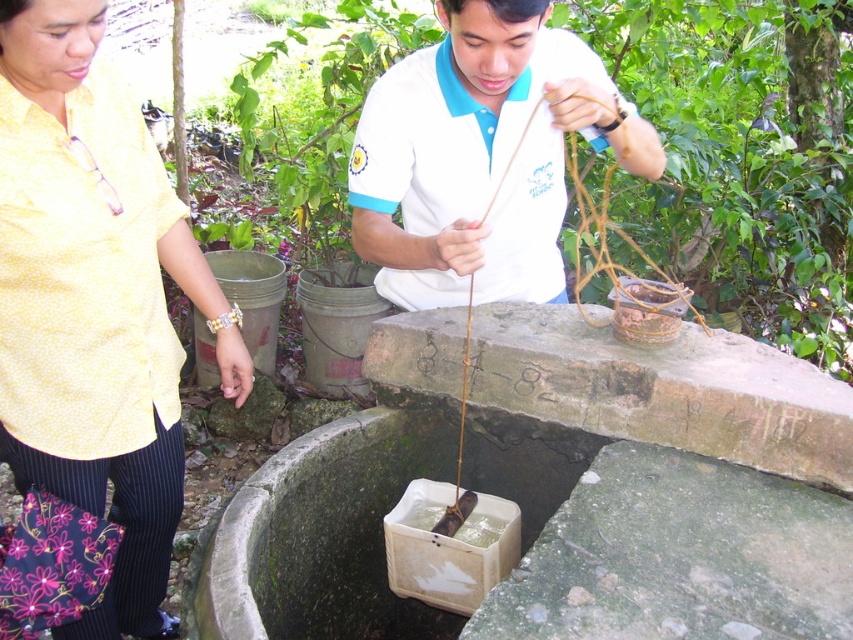
Question: Can you confirm if brown woven basket at center is thinner than yellow dotted shirt at upper left?

Choices:
 (A) no
 (B) yes

Answer: (A)

Question: Among these points, which one is farthest from the camera?

Choices:
 (A) (94, 442)
 (B) (840, 116)

Answer: (B)

Question: Is brown woven basket at center below yellow dotted shirt at upper left?

Choices:
 (A) yes
 (B) no

Answer: (B)

Question: Where is brown woven basket at center located in relation to yellow dotted shirt at upper left in the image?

Choices:
 (A) left
 (B) right

Answer: (B)